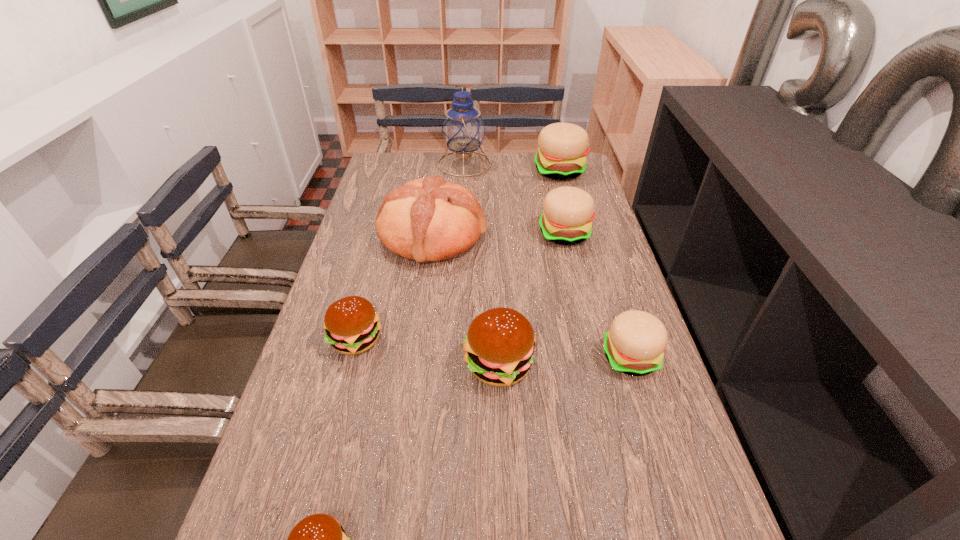
The width and height of the screenshot is (960, 540). I want to click on the nearest beige hamburger, so click(x=634, y=345).

In order to click on free space located 0.240m on the front-facing side of the blue lantern in this screenshot , I will do `click(553, 164)`.

Where is `vacant area situated on the front of the biggest beige hamburger`? The image size is (960, 540). vacant area situated on the front of the biggest beige hamburger is located at coordinates (567, 199).

I want to click on free region located on the front of the bread, so click(x=412, y=390).

What are the coordinates of `vacant space situated 0.170m on the right of the rightmost brown hamburger` in the screenshot? It's located at point(610,364).

I want to click on free space located 0.380m on the front of the second farthest hamburger, so click(592, 349).

Find the location of a particular element. The image size is (960, 540). vacant area located on the back of the second biggest brown hamburger is located at coordinates (379, 254).

Image resolution: width=960 pixels, height=540 pixels. What are the coordinates of `vacant point located 0.130m on the left of the smallest beige hamburger` in the screenshot? It's located at [546, 357].

Locate an element on the screen. This screenshot has height=540, width=960. lantern located at the far edge is located at coordinates (463, 129).

This screenshot has width=960, height=540. Identify the location of hamburger that is at the far edge. (562, 147).